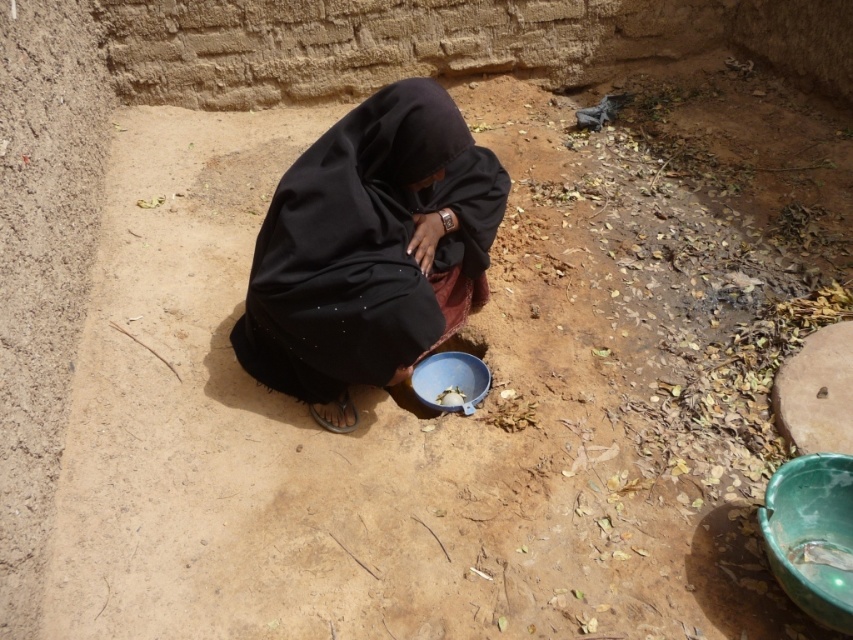
Question: Is green glossy bowl at lower right thinner than blue plastic bowl at center?

Choices:
 (A) yes
 (B) no

Answer: (B)

Question: Is black matte dress at center above green glossy bowl at lower right?

Choices:
 (A) no
 (B) yes

Answer: (B)

Question: Observing the image, what is the correct spatial positioning of green glossy bowl at lower right in reference to blue plastic bowl at center?

Choices:
 (A) below
 (B) above

Answer: (A)

Question: Which of the following is the farthest from the observer?

Choices:
 (A) green glossy bowl at lower right
 (B) blue plastic bowl at center

Answer: (B)

Question: Which point appears closest to the camera in this image?

Choices:
 (A) (485, 392)
 (B) (795, 570)

Answer: (B)

Question: Which object is closer to the camera taking this photo?

Choices:
 (A) green glossy bowl at lower right
 (B) black matte dress at center
 (C) blue plastic bowl at center

Answer: (A)